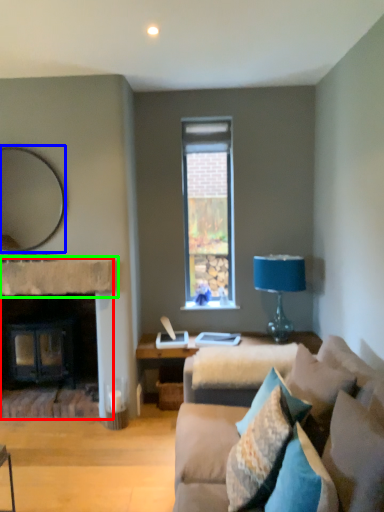
Question: Estimate the real-world distances between objects in this image. Which object is closer to fireplace (highlighted by a red box), mirror (highlighted by a blue box) or mantle (highlighted by a green box)?

Choices:
 (A) mirror
 (B) mantle

Answer: (B)